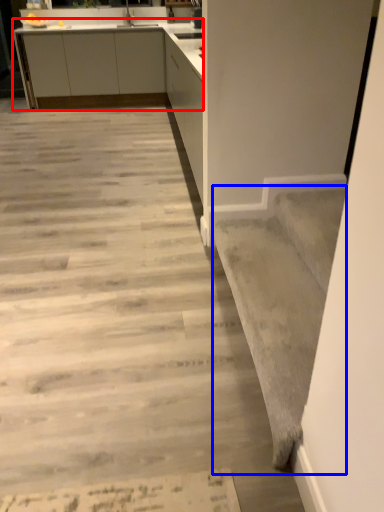
Question: Among these objects, which one is farthest to the camera, cabinetry (highlighted by a red box) or stairwell (highlighted by a blue box)?

Choices:
 (A) cabinetry
 (B) stairwell

Answer: (A)